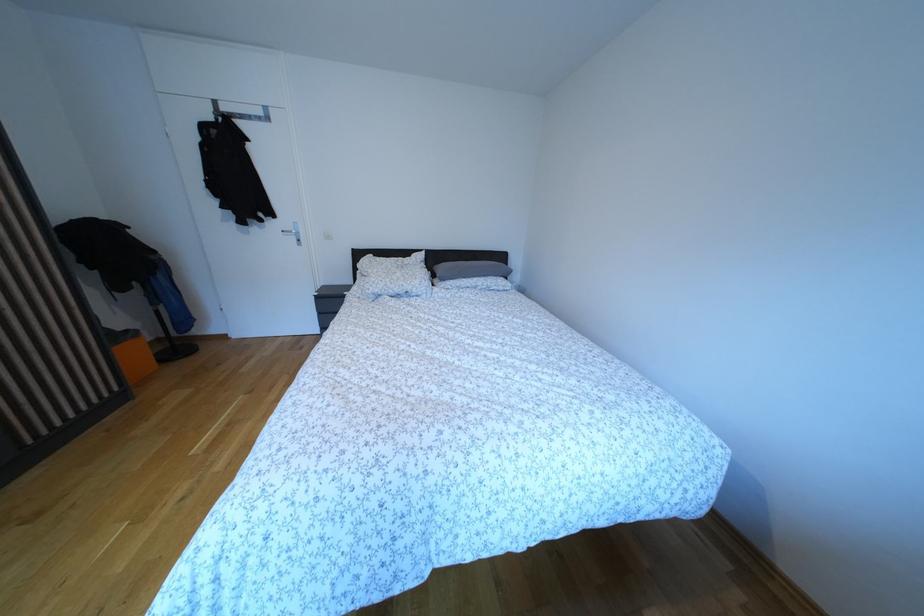
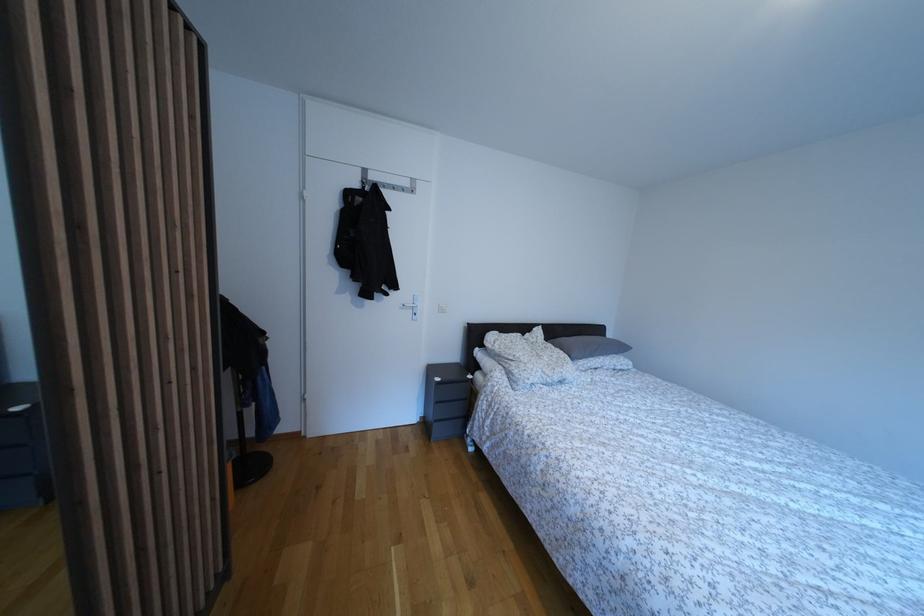
Question: What movement of the cameraman would produce the second image?

Choices:
 (A) Left
 (B) Right
 (C) Forward
 (D) Backward

Answer: (A)